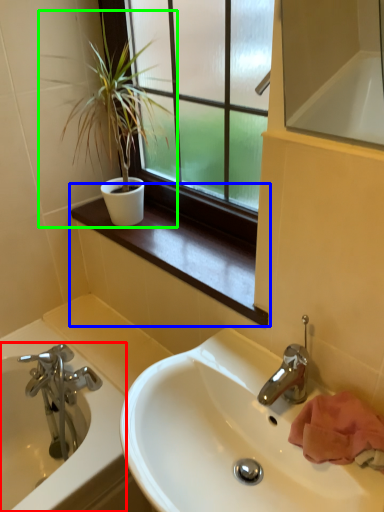
Question: Considering the real-world distances, which object is farthest from bathtub (highlighted by a red box)? window sill (highlighted by a blue box) or houseplant (highlighted by a green box)?

Choices:
 (A) window sill
 (B) houseplant

Answer: (B)